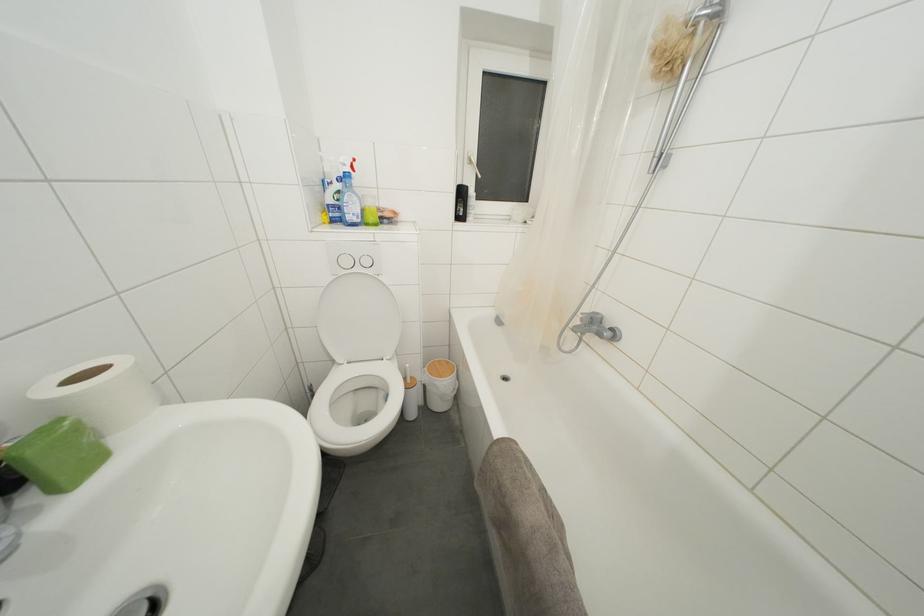
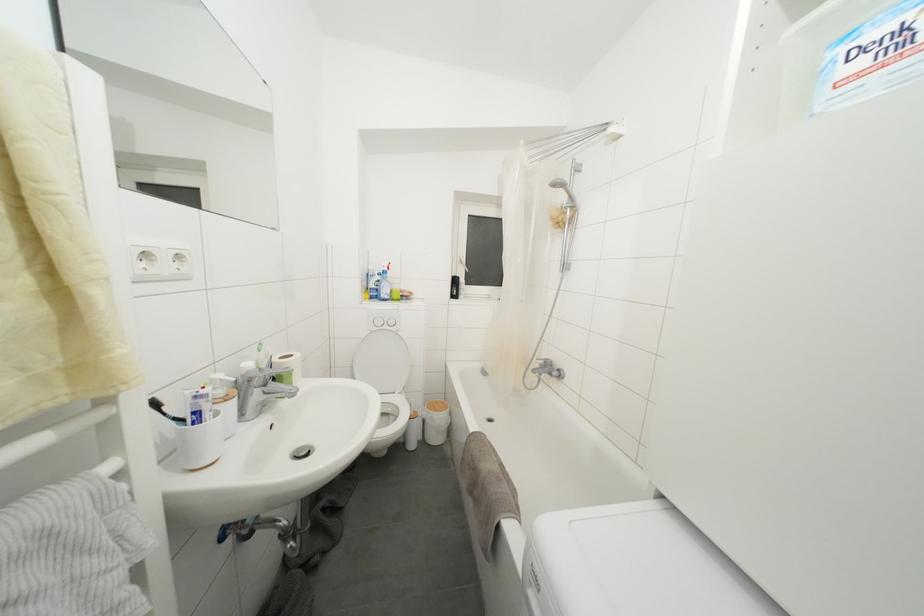
Find the pixel in the second image that matches (586,315) in the first image.

(540, 362)